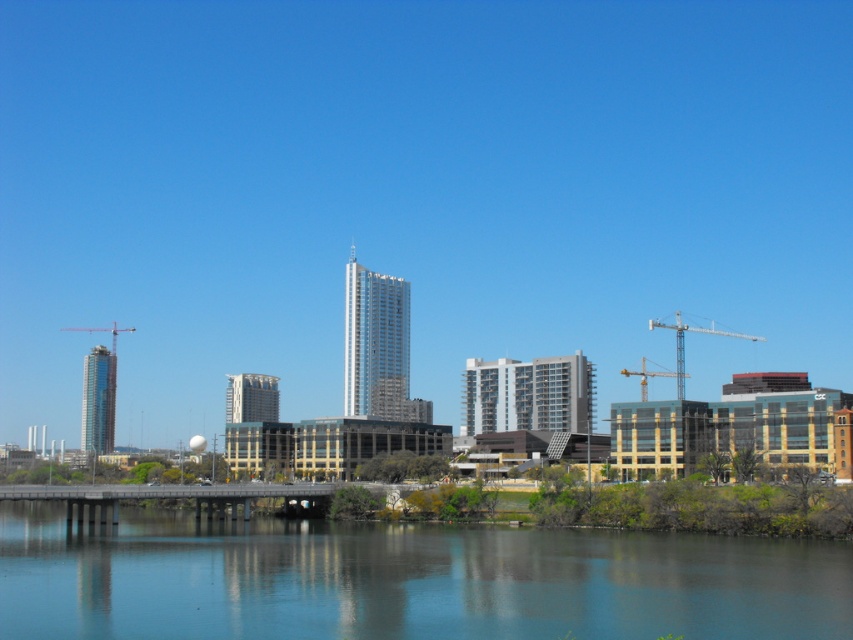
Question: Which object is positioned closest to the transparent glass water at center?

Choices:
 (A) yellow metallic crane at center-right
 (B) metallic construction crane at left
 (C) metallic gray crane at right

Answer: (A)

Question: Based on their relative distances, which object is farther from the metallic construction crane at left?

Choices:
 (A) metallic gray crane at right
 (B) transparent glass water at center

Answer: (B)

Question: Can you confirm if transparent glass water at center is positioned to the right of yellow metallic crane at center-right?

Choices:
 (A) no
 (B) yes

Answer: (A)

Question: Is metallic gray crane at right wider than yellow metallic crane at center-right?

Choices:
 (A) yes
 (B) no

Answer: (A)

Question: Considering the relative positions of metallic gray crane at right and metallic construction crane at left in the image provided, where is metallic gray crane at right located with respect to metallic construction crane at left?

Choices:
 (A) below
 (B) above

Answer: (A)

Question: Which point is farther to the camera?

Choices:
 (A) transparent glass water at center
 (B) metallic construction crane at left
 (C) metallic gray crane at right

Answer: (B)